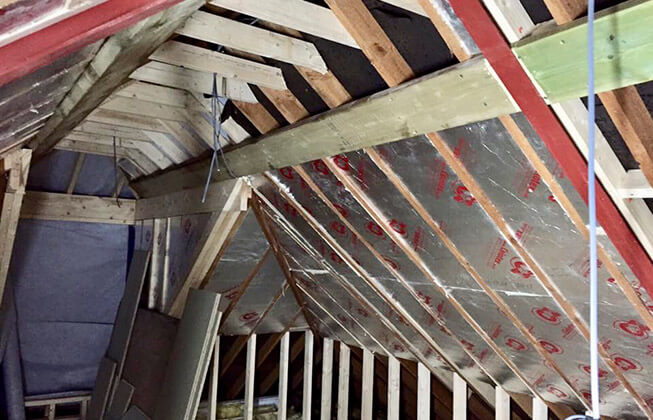
Where is `blue wall back drop`? blue wall back drop is located at coordinates (70, 297), (68, 340), (89, 173).